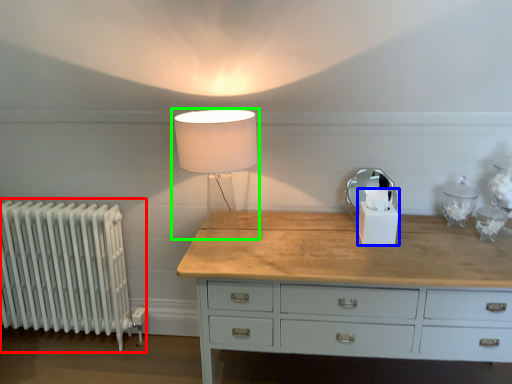
Question: Considering the real-world distances, which object is closest to radiator (highlighted by a red box)? candle holder (highlighted by a blue box) or lamp (highlighted by a green box).

Choices:
 (A) candle holder
 (B) lamp

Answer: (B)